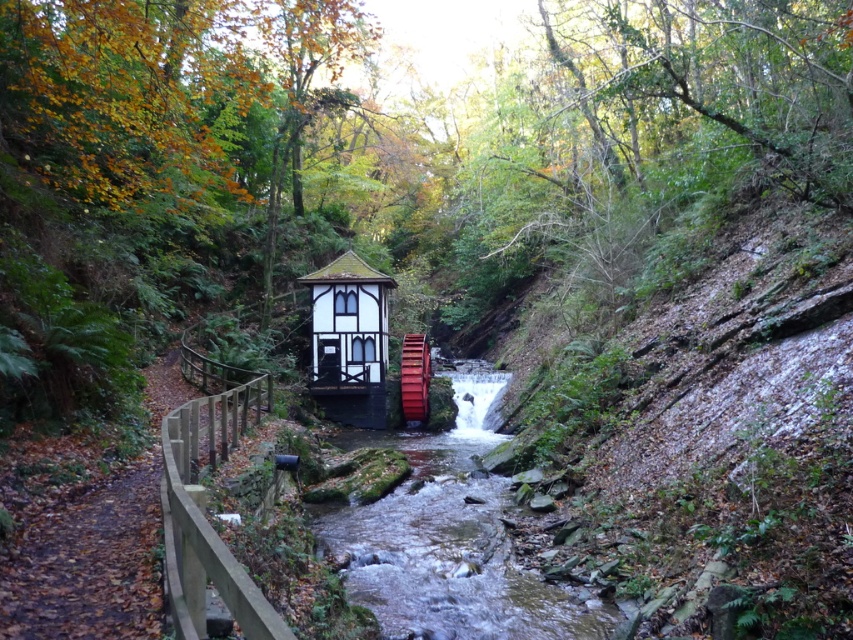
Is point (587, 628) behind point (386, 397)?

No, (587, 628) is closer to viewer.

The width and height of the screenshot is (853, 640). Describe the element at coordinates (448, 540) in the screenshot. I see `smooth concrete creek at center` at that location.

Image resolution: width=853 pixels, height=640 pixels. Identify the location of smooth concrete creek at center. (448, 540).